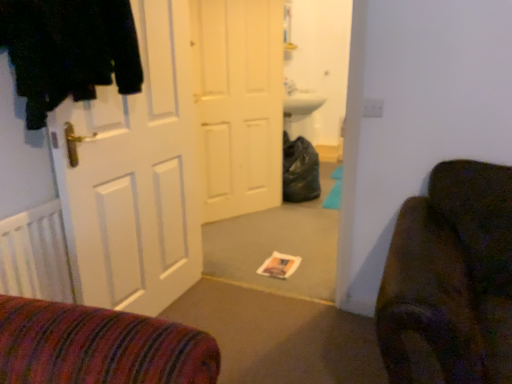
Question: Is white matte door at center, which is the second door in front-to-back order, shorter than black fuzzy coat at left?

Choices:
 (A) no
 (B) yes

Answer: (A)

Question: Is black fuzzy coat at left located within white matte door at center, arranged as the first door when viewed from the back?

Choices:
 (A) yes
 (B) no

Answer: (B)

Question: Does white matte door at center, arranged as the first door when viewed from the back, have a lesser width compared to black fuzzy coat at left?

Choices:
 (A) yes
 (B) no

Answer: (A)

Question: Does white matte door at center, which is the second door in front-to-back order, have a greater width compared to black fuzzy coat at left?

Choices:
 (A) yes
 (B) no

Answer: (B)

Question: Can you confirm if white matte door at center, which is the second door in front-to-back order, is positioned to the right of black fuzzy coat at left?

Choices:
 (A) no
 (B) yes

Answer: (B)

Question: In terms of size, does white matte door at center, arranged as the first door when viewed from the back, appear bigger or smaller than white matte door at left, which ranks as the 2th door in back-to-front order?

Choices:
 (A) small
 (B) big

Answer: (B)

Question: From the image's perspective, relative to white matte door at left, which ranks as the 2th door in back-to-front order, is white matte door at center, arranged as the first door when viewed from the back, above or below?

Choices:
 (A) above
 (B) below

Answer: (A)

Question: Considering the relative positions of white matte door at center, arranged as the first door when viewed from the back, and white matte door at left, which ranks as the 2th door in back-to-front order, in the image provided, is white matte door at center, arranged as the first door when viewed from the back, to the left or to the right of white matte door at left, which ranks as the 2th door in back-to-front order,?

Choices:
 (A) right
 (B) left

Answer: (A)

Question: Is point (232, 21) closer or farther from the camera than point (164, 104)?

Choices:
 (A) closer
 (B) farther

Answer: (B)

Question: Which is correct: black fuzzy coat at left is inside white matte door at left, which appears as the first door when viewed from the front, or outside of it?

Choices:
 (A) outside
 (B) inside

Answer: (A)

Question: From the image's perspective, is black fuzzy coat at left positioned above or below white matte door at left, which appears as the first door when viewed from the front?

Choices:
 (A) below
 (B) above

Answer: (B)

Question: Looking at the image, does black fuzzy coat at left seem bigger or smaller compared to white matte door at left, which appears as the first door when viewed from the front?

Choices:
 (A) big
 (B) small

Answer: (B)

Question: In the image, is black fuzzy coat at left positioned in front of or behind white matte door at left, which appears as the first door when viewed from the front?

Choices:
 (A) behind
 (B) front

Answer: (B)

Question: In terms of width, does white matte door at left, which appears as the first door when viewed from the front, look wider or thinner when compared to black fuzzy coat at left?

Choices:
 (A) thin
 (B) wide

Answer: (A)

Question: Is white matte door at left, which ranks as the 2th door in back-to-front order, taller or shorter than black fuzzy coat at left?

Choices:
 (A) short
 (B) tall

Answer: (B)